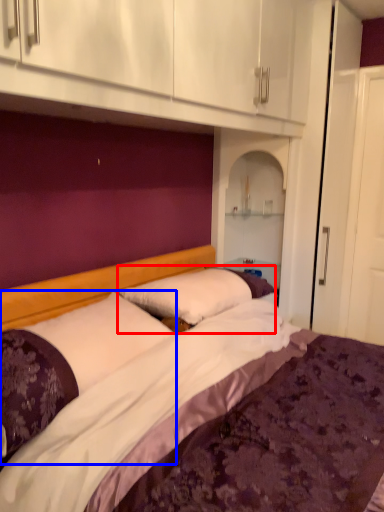
Question: Which point is further to the camera, pillow (highlighted by a red box) or pillow (highlighted by a blue box)?

Choices:
 (A) pillow
 (B) pillow

Answer: (A)